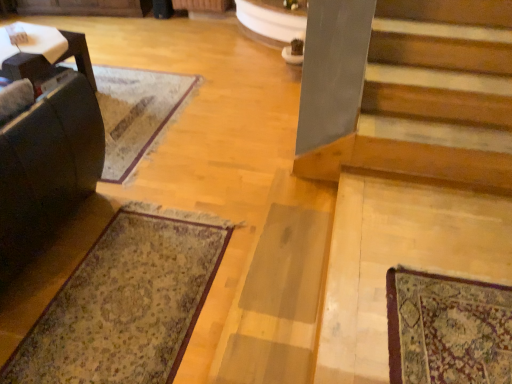
The image size is (512, 384). What do you see at coordinates (47, 169) in the screenshot?
I see `dark brown leather rocking chair at left` at bounding box center [47, 169].

What do you see at coordinates (126, 302) in the screenshot?
I see `patterned carpet at lower left` at bounding box center [126, 302].

Locate an element on the screen. The image size is (512, 384). wooden stairs at lower right is located at coordinates (417, 170).

Is patterned carpet at lower left to the left of wooden stairs at lower right from the viewer's perspective?

Correct, you'll find patterned carpet at lower left to the left of wooden stairs at lower right.

Considering the points (131, 297) and (449, 177), which point is in front, point (131, 297) or point (449, 177)?

Point (131, 297)

Which of these two, patterned carpet at lower left or wooden stairs at lower right, is thinner?

patterned carpet at lower left.

Considering the positions of objects dark brown leather rocking chair at left and patterned carpet at lower left in the image provided, who is more to the right, dark brown leather rocking chair at left or patterned carpet at lower left?

Positioned to the right is patterned carpet at lower left.

Where is `mat that appears behind the dark brown leather rocking chair at left`? mat that appears behind the dark brown leather rocking chair at left is located at coordinates (126, 302).

Is point (25, 188) farther from viewer compared to point (41, 349)?

Yes.

Considering the positions of objects dark brown leather rocking chair at left and patterned carpet at lower left in the image provided, who is behind, dark brown leather rocking chair at left or patterned carpet at lower left?

patterned carpet at lower left is more distant.

The width and height of the screenshot is (512, 384). Identify the location of stairs that is in front of the dark brown leather rocking chair at left. (417, 170).

Based on the photo, from the image's perspective, between dark brown leather rocking chair at left and wooden stairs at lower right, who is located below?

wooden stairs at lower right.

Which of these two, dark brown leather rocking chair at left or wooden stairs at lower right, is thinner?

With smaller width is wooden stairs at lower right.

Is dark brown leather rocking chair at left looking in the opposite direction of wooden stairs at lower right?

No, dark brown leather rocking chair at left is not facing away from wooden stairs at lower right.

Looking at their sizes, would you say patterned carpet at lower left is wider or thinner than dark brown leather rocking chair at left?

Considering their sizes, patterned carpet at lower left looks slimmer than dark brown leather rocking chair at left.

Which of these two, patterned carpet at lower left or dark brown leather rocking chair at left, is bigger?

With larger size is dark brown leather rocking chair at left.

How many degrees apart are the facing directions of patterned carpet at lower left and dark brown leather rocking chair at left?

They differ by 90.3 degrees in their facing directions.

Based on their positions, is patterned carpet at lower left located to the left or right of dark brown leather rocking chair at left?

In the image, patterned carpet at lower left appears on the right side of dark brown leather rocking chair at left.

Which is more to the right, wooden stairs at lower right or dark brown leather rocking chair at left?

Positioned to the right is wooden stairs at lower right.

From the image's perspective, which object appears higher, wooden stairs at lower right or dark brown leather rocking chair at left?

dark brown leather rocking chair at left.

Who is taller, wooden stairs at lower right or dark brown leather rocking chair at left?

With more height is dark brown leather rocking chair at left.

Considering the positions of point (454, 251) and point (63, 116), is point (454, 251) closer or farther from the camera than point (63, 116)?

Point (454, 251) is positioned closer to the camera compared to point (63, 116).

Is wooden stairs at lower right completely or partially outside of patterned carpet at lower left?

Yes.

Does wooden stairs at lower right turn towards patterned carpet at lower left?

No, wooden stairs at lower right is not oriented towards patterned carpet at lower left.

Considering the sizes of objects wooden stairs at lower right and patterned carpet at lower left in the image provided, who is shorter, wooden stairs at lower right or patterned carpet at lower left?

With less height is wooden stairs at lower right.

I want to click on stairs on the right side of patterned carpet at lower left, so click(x=417, y=170).

This screenshot has width=512, height=384. There is a patterned carpet at lower left. What are the coordinates of `rocking chair above it (from a real-world perspective)` in the screenshot? It's located at (47, 169).

From the image, which object appears to be nearer to patterned carpet at lower left, dark brown leather rocking chair at left or wooden stairs at lower right?

Based on the image, dark brown leather rocking chair at left appears to be nearer to patterned carpet at lower left.

Estimate the real-world distances between objects in this image. Which object is closer to wooden stairs at lower right, dark brown leather rocking chair at left or patterned carpet at lower left?

Based on the image, patterned carpet at lower left appears to be nearer to wooden stairs at lower right.

Based on the photo, estimate the real-world distances between objects in this image. Which object is closer to wooden stairs at lower right, patterned carpet at lower left or dark brown leather rocking chair at left?

patterned carpet at lower left.

When comparing their distances from dark brown leather rocking chair at left, does patterned carpet at lower left or wooden stairs at lower right seem further?

Among the two, wooden stairs at lower right is located further to dark brown leather rocking chair at left.

Looking at the image, which one is located closer to patterned carpet at lower left, wooden stairs at lower right or dark brown leather rocking chair at left?

dark brown leather rocking chair at left is closer to patterned carpet at lower left.

Consider the image. When comparing their distances from dark brown leather rocking chair at left, does wooden stairs at lower right or patterned carpet at lower left seem further?

Among the two, wooden stairs at lower right is located further to dark brown leather rocking chair at left.

What are the coordinates of `mat between dark brown leather rocking chair at left and wooden stairs at lower right` in the screenshot? It's located at [126, 302].